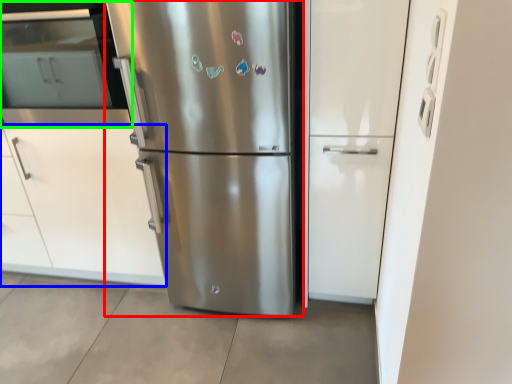
Question: Which object is the closest to the refrigerator (highlighted by a red box)? Choose among these: cabinetry (highlighted by a blue box) or oven (highlighted by a green box).

Choices:
 (A) cabinetry
 (B) oven

Answer: (A)